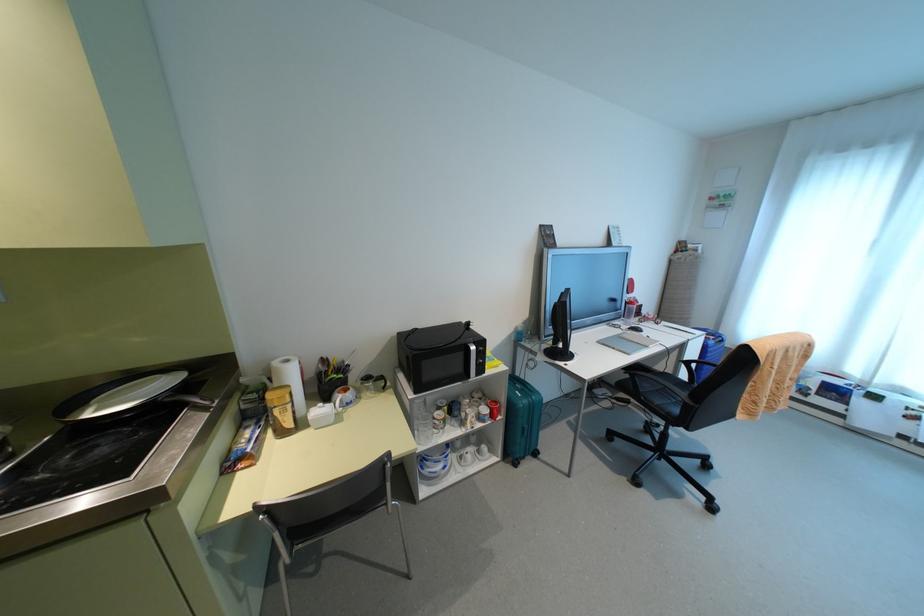
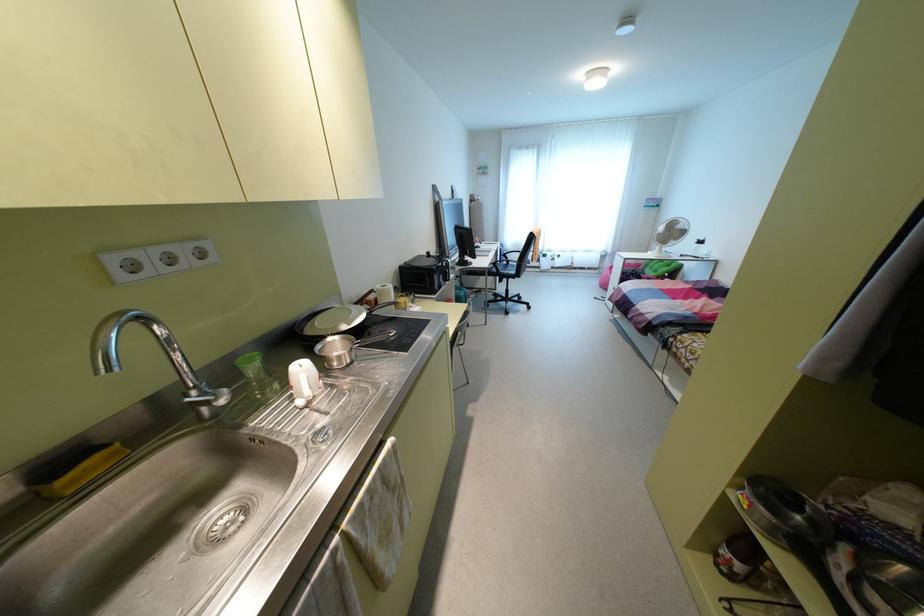
The point at (95, 410) is marked in the first image. Where is the corresponding point in the second image?

(348, 323)